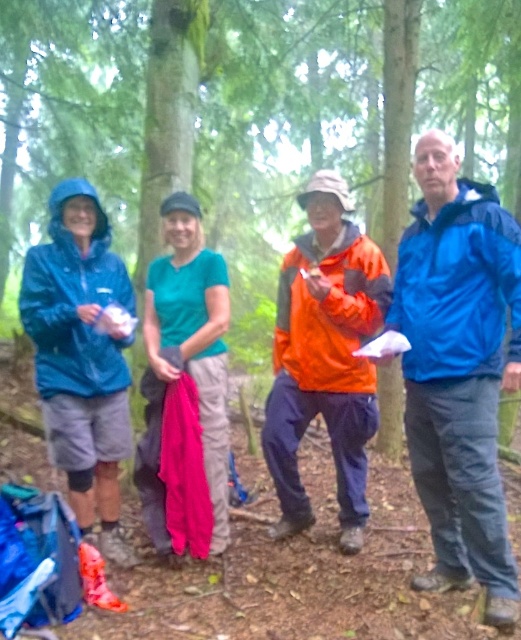
Question: Is blue smooth jacket at right closer to camera compared to matte blue jacket at left?

Choices:
 (A) no
 (B) yes

Answer: (B)

Question: Estimate the real-world distances between objects in this image. Which object is farther from the matte blue jacket at left?

Choices:
 (A) orange waterproof jacket at center
 (B) blue smooth jacket at right

Answer: (B)

Question: Does green matte tree at center have a lesser width compared to matte blue jacket at left?

Choices:
 (A) no
 (B) yes

Answer: (A)

Question: Which of the following is the farthest from the observer?

Choices:
 (A) green matte tree at center
 (B) matte blue jacket at left

Answer: (A)

Question: Among these points, which one is farthest from the camera?

Choices:
 (A) (80, 76)
 (B) (353, 406)

Answer: (A)

Question: In this image, where is blue smooth jacket at right located relative to matte blue jacket at left?

Choices:
 (A) below
 (B) above

Answer: (B)